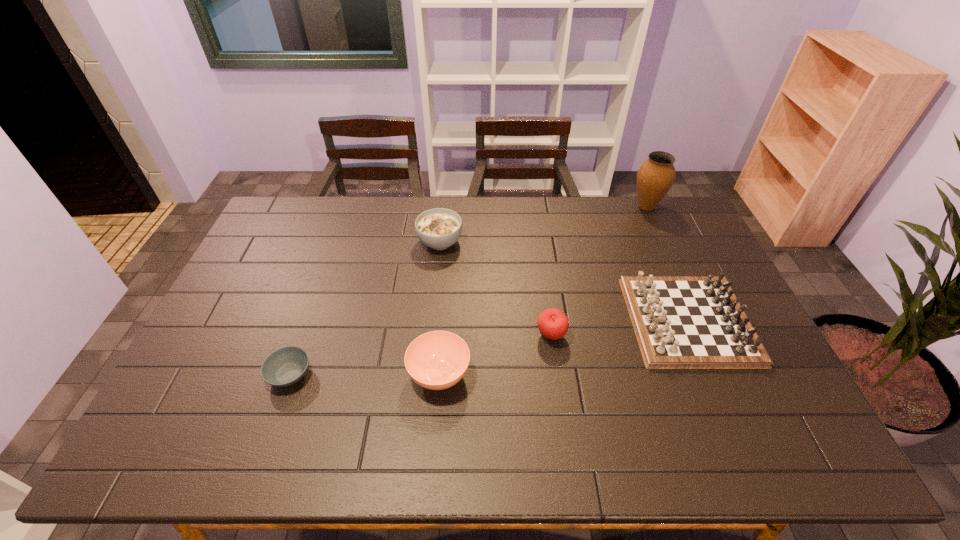
Identify the location of soup bowl that is the second closest to the tallest soup bowl. This screenshot has width=960, height=540. (285, 366).

Image resolution: width=960 pixels, height=540 pixels. I want to click on free space that satisfies the following two spatial constraints: 1. from the player's perspective of the chessboard; 2. on the front side of the leftmost object, so coord(711,374).

Locate an element on the screen. The width and height of the screenshot is (960, 540). vacant area in the image that satisfies the following two spatial constraints: 1. on the back side of the second shortest soup bowl; 2. on the right side of the tallest object is located at coordinates (452, 206).

Identify the location of vacant space that satisfies the following two spatial constraints: 1. on the back side of the urn; 2. on the left side of the fourth object from left to right. (533, 206).